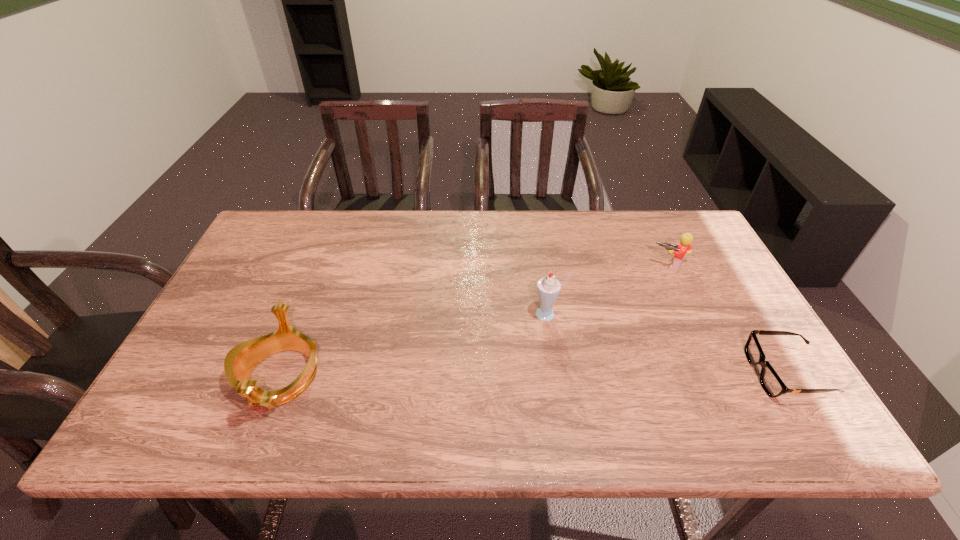
Where is `free space that satisfies the following two spatial constraints: 1. on the back side of the second object from right to left; 2. on the right side of the milkshake`? free space that satisfies the following two spatial constraints: 1. on the back side of the second object from right to left; 2. on the right side of the milkshake is located at coordinates (541, 266).